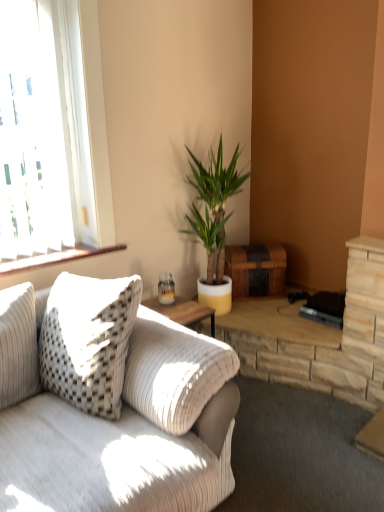
The height and width of the screenshot is (512, 384). Identify the location of clear glass window at upper left. (50, 141).

What do you see at coordinates (50, 141) in the screenshot? I see `clear glass window at upper left` at bounding box center [50, 141].

Where is `wooden at left`? Image resolution: width=384 pixels, height=512 pixels. wooden at left is located at coordinates (56, 258).

From the image's perspective, is white corduroy couch at left on clear glass window at upper left?

No, from the image's perspective, white corduroy couch at left is not above clear glass window at upper left.

Between white corduroy couch at left and clear glass window at upper left, which one is positioned behind?

Positioned behind is clear glass window at upper left.

Locate an element on the screen. The width and height of the screenshot is (384, 512). window that is above the white corduroy couch at left (from the image's perspective) is located at coordinates (50, 141).

What's the angular difference between white corduroy couch at left and clear glass window at upper left's facing directions?

87.3 degrees.

From the image's perspective, is green leafy plant at center beneath clear glass window at upper left?

Yes.

Which of these two, green leafy plant at center or clear glass window at upper left, is thinner?

Thinner between the two is clear glass window at upper left.

Can you tell me how much green leafy plant at center and clear glass window at upper left differ in facing direction?

There is a 0.517-degree angle between the facing directions of green leafy plant at center and clear glass window at upper left.

Is point (215, 184) behind point (0, 186)?

Yes.

Looking at this image, relative to white corduroy couch at left, is green leafy plant at center in front or behind?

In the image, green leafy plant at center appears behind white corduroy couch at left.

From the image's perspective, would you say green leafy plant at center is shown under white corduroy couch at left?

Incorrect, from the image's perspective, green leafy plant at center is higher than white corduroy couch at left.

Which object is positioned more to the right, green leafy plant at center or white corduroy couch at left?

green leafy plant at center.

Who is smaller, white corduroy couch at left or green leafy plant at center?

Smaller between the two is green leafy plant at center.

Would you say white corduroy couch at left is to the left or to the right of green leafy plant at center in the picture?

In the image, white corduroy couch at left appears on the left side of green leafy plant at center.

Is white corduroy couch at left placed right next to green leafy plant at center?

No, white corduroy couch at left is not next to green leafy plant at center.

From the picture: Relative to green leafy plant at center, is white corduroy couch at left in front or behind?

white corduroy couch at left is in front of green leafy plant at center.

Locate an element on the screen. The image size is (384, 512). window in front of the wooden at left is located at coordinates (50, 141).

Considering the sizes of objects clear glass window at upper left and wooden at left in the image provided, who is bigger, clear glass window at upper left or wooden at left?

Bigger between the two is clear glass window at upper left.

In the scene shown: Is clear glass window at upper left taller than wooden at left?

Yes.

Considering the positions of objects clear glass window at upper left and wooden at left in the image provided, who is more to the left, clear glass window at upper left or wooden at left?

Positioned to the left is clear glass window at upper left.

From a real-world perspective, who is located higher, wooden at left or clear glass window at upper left?

In real-world perspective, clear glass window at upper left is above.

In terms of size, does wooden at left appear bigger or smaller than clear glass window at upper left?

Clearly, wooden at left is smaller in size than clear glass window at upper left.

Which is more to the left, wooden at left or clear glass window at upper left?

Positioned to the left is clear glass window at upper left.

Looking at this image, from a real-world perspective, relative to green leafy plant at center, is wooden at left vertically above or below?

Clearly, from a real-world perspective, wooden at left is below green leafy plant at center.

Which is behind, point (40, 261) or point (205, 204)?

The point (205, 204) is farther.

Between wooden at left and green leafy plant at center, which one has smaller width?

wooden at left is thinner.

Is green leafy plant at center at the back of wooden at left?

No, wooden at left is not facing the opposite direction of green leafy plant at center.

Image resolution: width=384 pixels, height=512 pixels. What are the coordinates of `window on the left of white corduroy couch at left` in the screenshot? It's located at [50, 141].

At what (x,y) coordinates should I click in order to perform the action: click on houseplant behind the clear glass window at upper left. Please return your answer as a coordinate pair (x, y). Image resolution: width=384 pixels, height=512 pixels. Looking at the image, I should click on (214, 204).

Considering their positions, is clear glass window at upper left positioned further to wooden at left than white corduroy couch at left?

Among the two, white corduroy couch at left is located further to wooden at left.

Based on their spatial positions, is white corduroy couch at left or clear glass window at upper left further from wooden at left?

Among the two, white corduroy couch at left is located further to wooden at left.

Which object lies nearer to the anchor point white corduroy couch at left, green leafy plant at center or clear glass window at upper left?

Based on the image, clear glass window at upper left appears to be nearer to white corduroy couch at left.

In the scene shown: Considering their positions, is clear glass window at upper left positioned further to green leafy plant at center than wooden at left?

Based on the image, clear glass window at upper left appears to be further to green leafy plant at center.

Which object lies nearer to the anchor point clear glass window at upper left, white corduroy couch at left or wooden at left?

Based on the image, wooden at left appears to be nearer to clear glass window at upper left.

Estimate the real-world distances between objects in this image. Which object is further from white corduroy couch at left, clear glass window at upper left or green leafy plant at center?

green leafy plant at center is further to white corduroy couch at left.

Considering their positions, is white corduroy couch at left positioned closer to wooden at left than green leafy plant at center?

Among the two, green leafy plant at center is located nearer to wooden at left.

When comparing their distances from wooden at left, does green leafy plant at center or white corduroy couch at left seem closer?

Based on the image, green leafy plant at center appears to be nearer to wooden at left.

Where is `window sill between clear glass window at upper left and green leafy plant at center in the horizontal direction`? This screenshot has height=512, width=384. window sill between clear glass window at upper left and green leafy plant at center in the horizontal direction is located at coordinates (56, 258).

Image resolution: width=384 pixels, height=512 pixels. What are the coordinates of `studio couch located between clear glass window at upper left and green leafy plant at center in the left-right direction` in the screenshot? It's located at tap(109, 405).

Identify the location of window sill between white corduroy couch at left and green leafy plant at center along the z-axis. This screenshot has width=384, height=512. (56, 258).

The image size is (384, 512). What are the coordinates of `window sill between clear glass window at upper left and white corduroy couch at left vertically` in the screenshot? It's located at (56, 258).